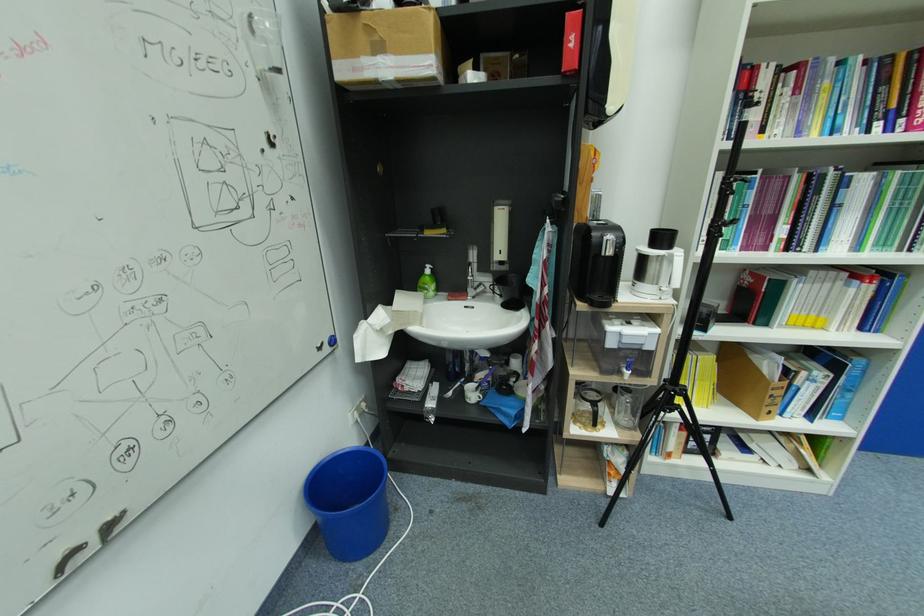
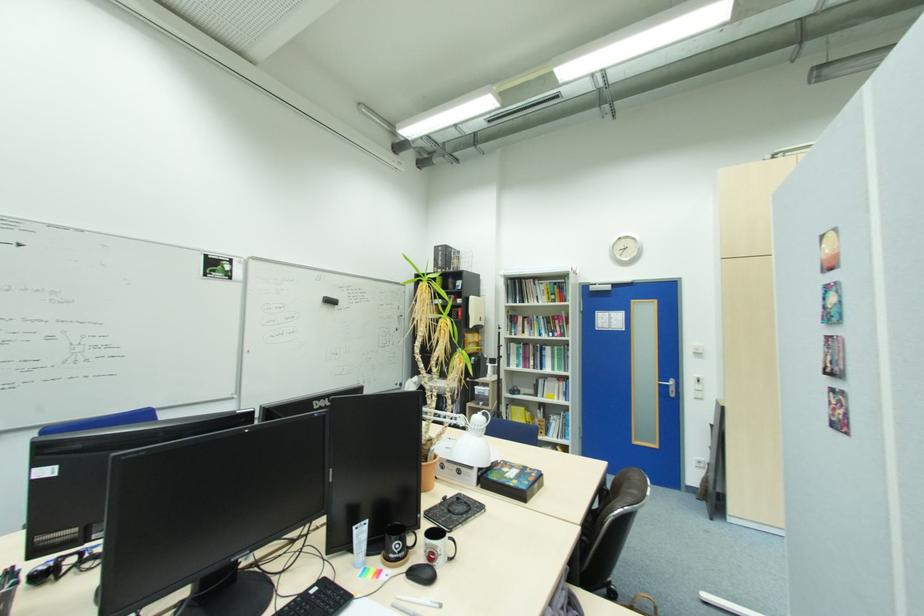
In the second image, find the point that corresponds to [861,126] in the first image.

(550, 334)